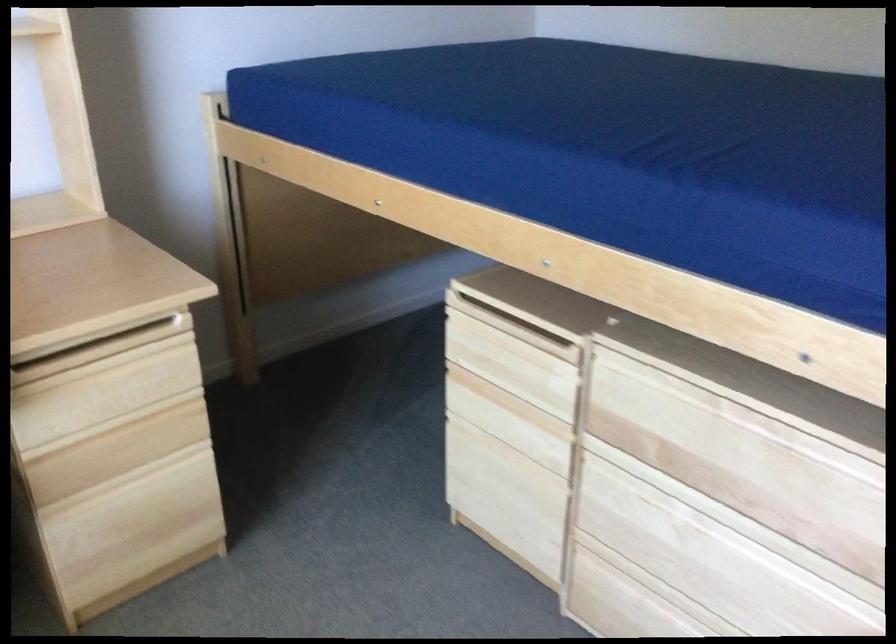
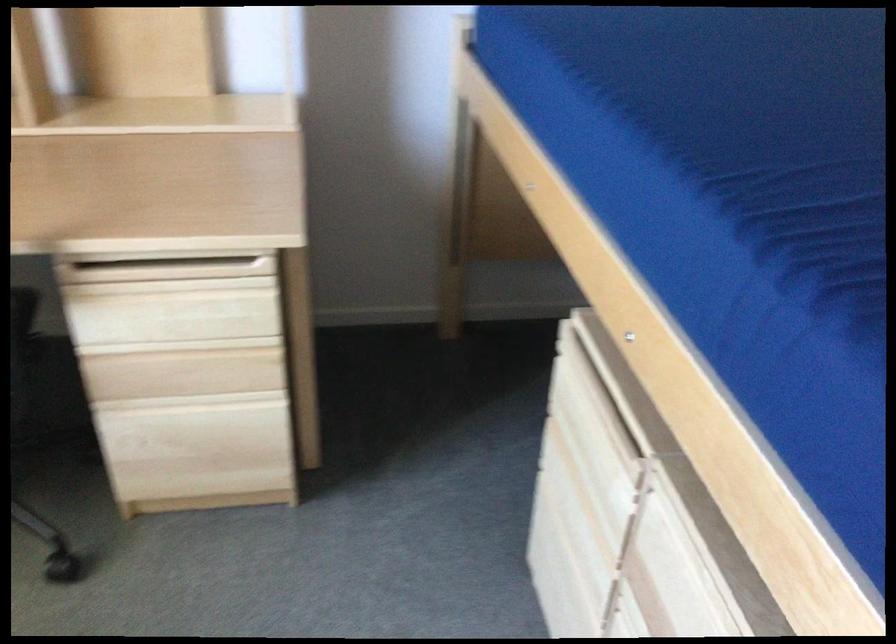
Locate, in the second image, the point that corresponds to (116,421) in the first image.

(179, 346)